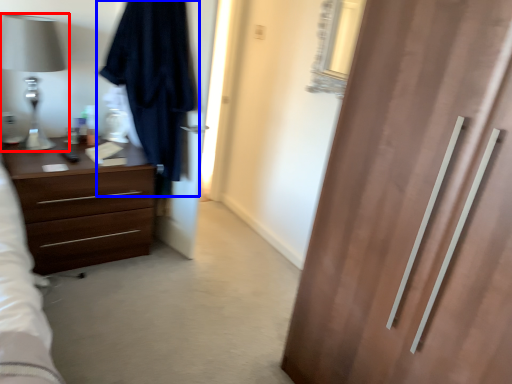
Question: Among these objects, which one is nearest to the camera, table lamp (highlighted by a red box) or robe (highlighted by a blue box)?

Choices:
 (A) table lamp
 (B) robe

Answer: (B)